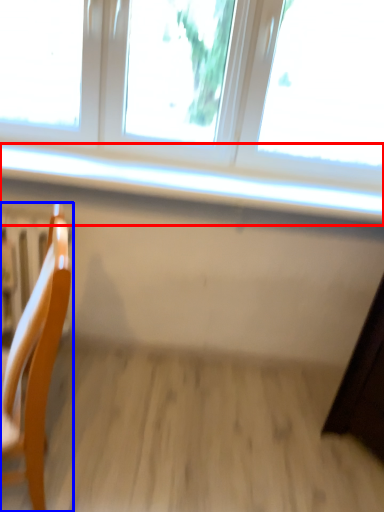
Question: Which point is closer to the camera, window sill (highlighted by a red box) or chair (highlighted by a blue box)?

Choices:
 (A) window sill
 (B) chair

Answer: (B)